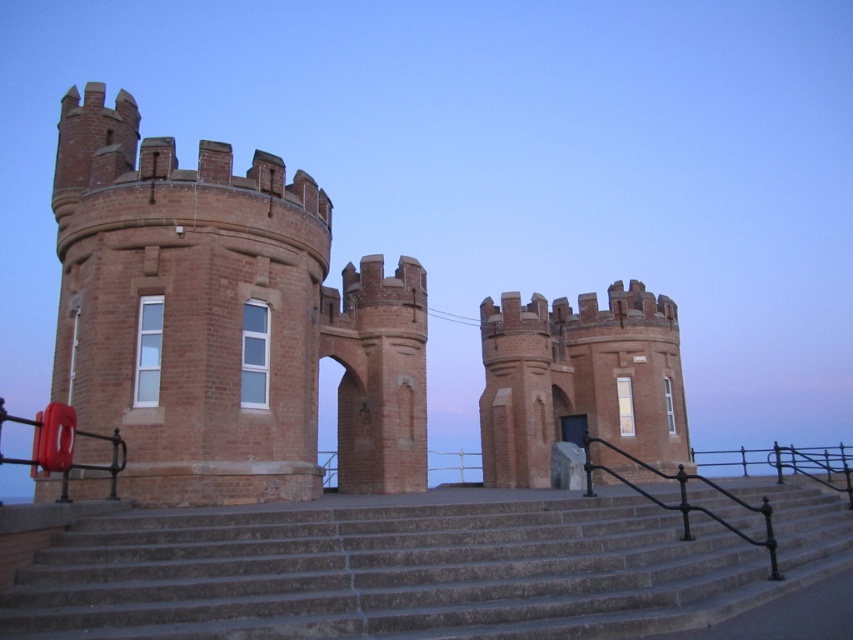
Between brick tower at center and gray concrete stairs at center, which one is positioned lower?

Positioned lower is gray concrete stairs at center.

Does brick tower at center lie behind gray concrete stairs at center?

Yes, brick tower at center is behind gray concrete stairs at center.

Find the location of a particular element. This screenshot has width=853, height=640. brick tower at center is located at coordinates (224, 321).